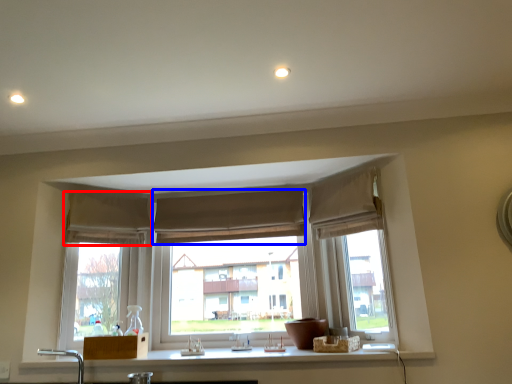
Question: Which of the following is the closest to the observer, curtain (highlighted by a red box) or curtain (highlighted by a blue box)?

Choices:
 (A) curtain
 (B) curtain

Answer: (A)